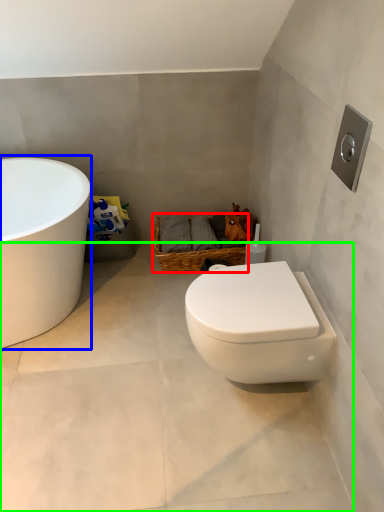
Question: Based on their relative distances, which object is farther from basket (highlighted by a red box)? Choose from bathtub (highlighted by a blue box) and concrete (highlighted by a green box).

Choices:
 (A) bathtub
 (B) concrete

Answer: (B)